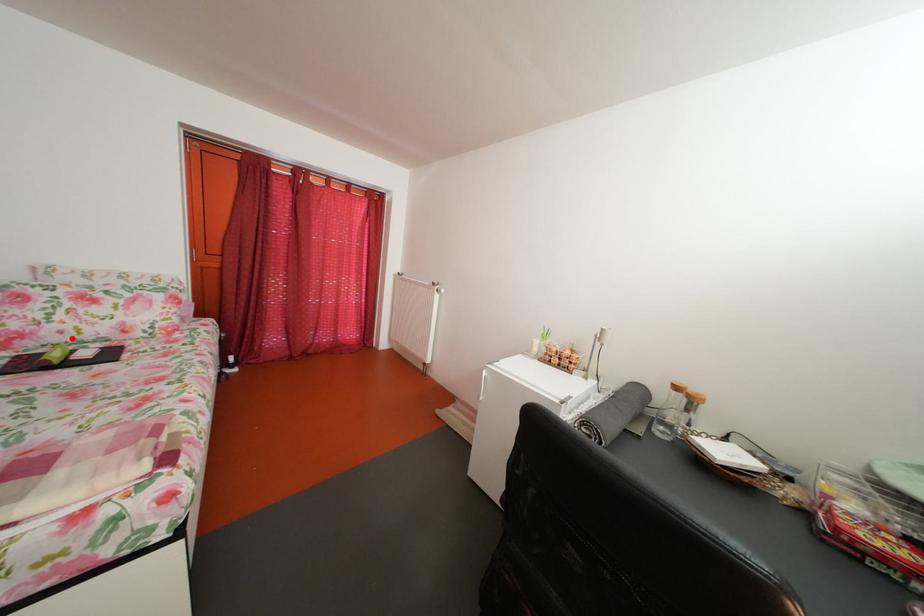
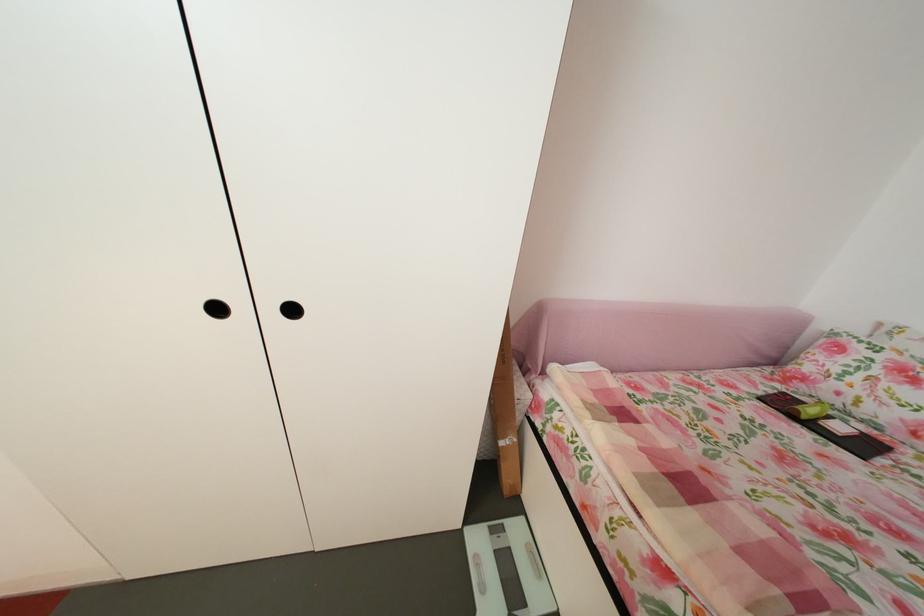
In the second image, find the point that corresponds to the highlighted location in the first image.

(849, 400)